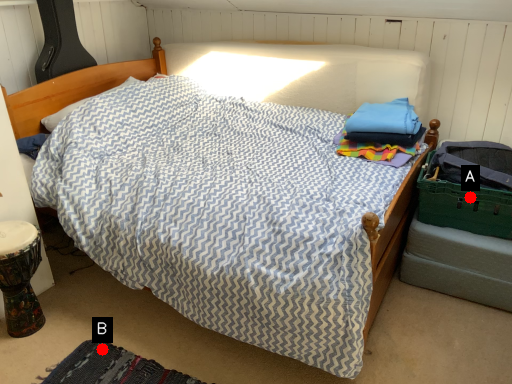
Question: Two points are circled on the image, labeled by A and B beside each circle. Among these points, which one is nearest to the camera?

Choices:
 (A) A is closer
 (B) B is closer

Answer: (B)